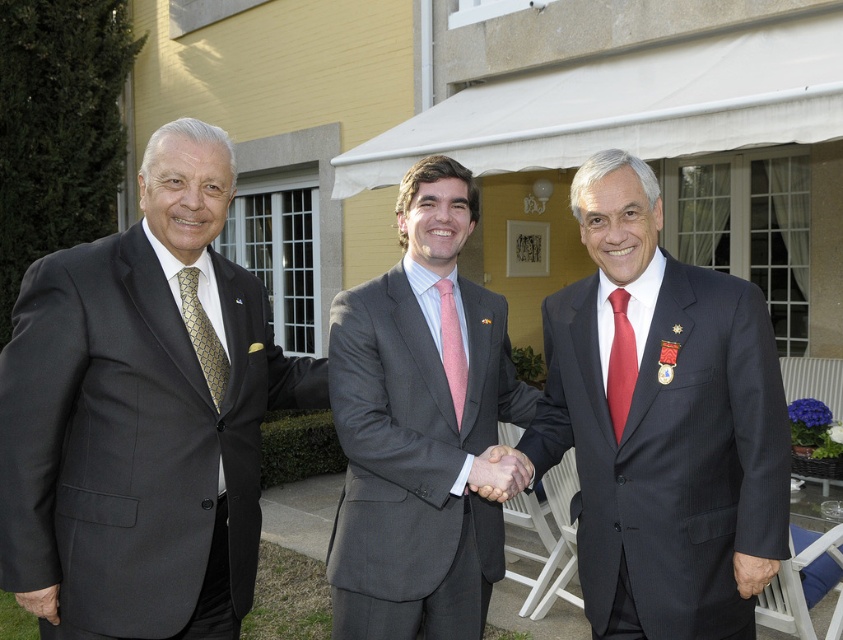
Question: Which object appears farthest from the camera in this image?

Choices:
 (A) matte red tie at center
 (B) gold textured tie at left

Answer: (A)

Question: Considering the real-world distances, which object is closest to the matte black suit at left?

Choices:
 (A) matte red tie at center
 (B) pink textured tie at center
 (C) gold textured tie at left
 (D) matte black suit at center

Answer: (C)

Question: Among these points, which one is nearest to the camera?

Choices:
 (A) (760, 566)
 (B) (619, 376)
 (C) (503, 452)

Answer: (A)

Question: Does matte black hand at center appear on the right side of smooth skin hand at center?

Choices:
 (A) no
 (B) yes

Answer: (A)

Question: Does matte black suit at left have a lesser width compared to matte gray suit at center?

Choices:
 (A) no
 (B) yes

Answer: (A)

Question: Does matte red tie at center lie in front of smooth skin hand at center?

Choices:
 (A) yes
 (B) no

Answer: (B)